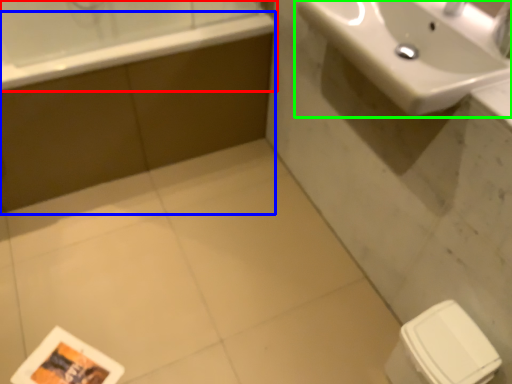
Question: Which object is the farthest from bathtub (highlighted by a red box)? Choose among these: bath (highlighted by a blue box) or sink (highlighted by a green box).

Choices:
 (A) bath
 (B) sink

Answer: (B)